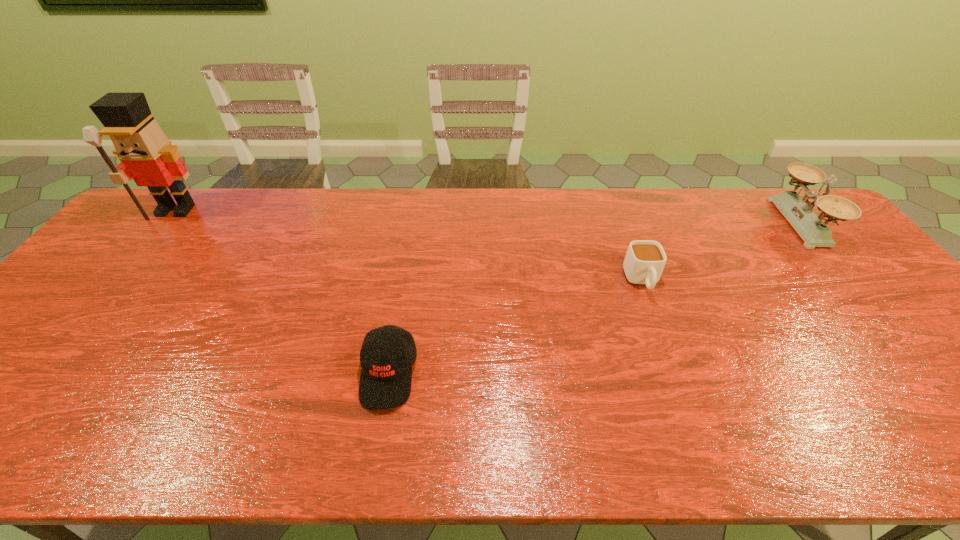
Where is `free region located 0.270m on the front-facing side of the scale`? This screenshot has height=540, width=960. free region located 0.270m on the front-facing side of the scale is located at coordinates (699, 223).

Locate an element on the screen. The width and height of the screenshot is (960, 540). free spot located 0.210m on the front-facing side of the scale is located at coordinates (717, 223).

The image size is (960, 540). Find the location of `free space located 0.200m on the side with the handle of the second object from right to left`. free space located 0.200m on the side with the handle of the second object from right to left is located at coordinates (671, 362).

Where is `nutcracker located in the far edge section of the desktop`? The width and height of the screenshot is (960, 540). nutcracker located in the far edge section of the desktop is located at coordinates (146, 155).

Identify the location of scale that is at the far edge. This screenshot has width=960, height=540. (797, 210).

Locate an element on the screen. The width and height of the screenshot is (960, 540). object present at the left edge is located at coordinates (146, 155).

The width and height of the screenshot is (960, 540). Identify the location of object that is at the right edge. (797, 210).

I want to click on object that is at the far left corner, so click(x=146, y=155).

Where is `object at the far right corner`? The height and width of the screenshot is (540, 960). object at the far right corner is located at coordinates (797, 210).

Find the location of a particular element. free space at the far edge is located at coordinates (398, 194).